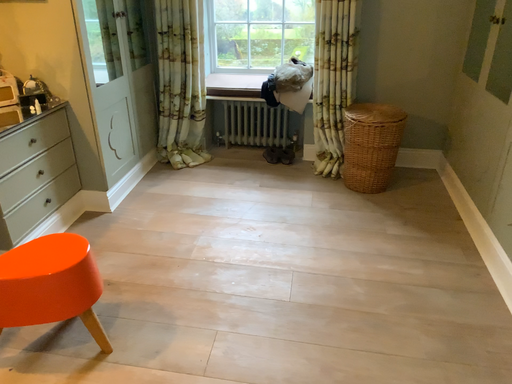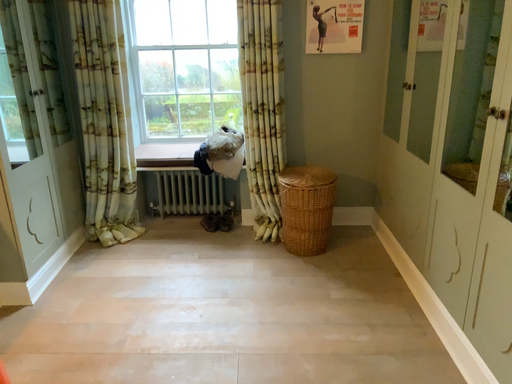
Question: How did the camera likely rotate when shooting the video?

Choices:
 (A) rotated upward
 (B) rotated downward

Answer: (A)